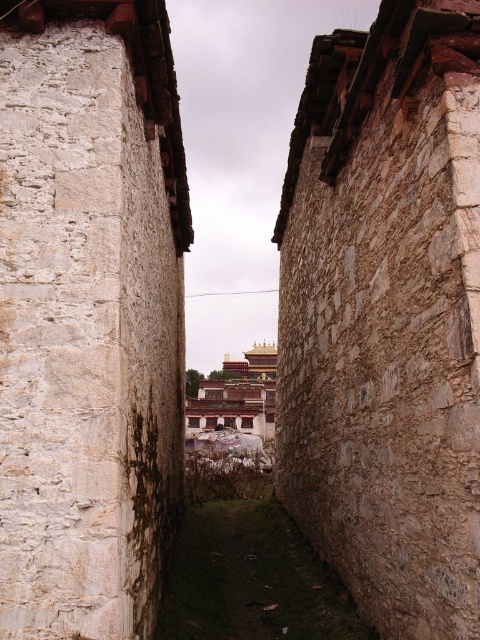
Question: Is white stone wall at center to the right of white stone monastery at center from the viewer's perspective?

Choices:
 (A) yes
 (B) no

Answer: (A)

Question: Which object is the closest to the white stone monastery at center?

Choices:
 (A) white stone wall at center
 (B) brown stone wall at right

Answer: (B)

Question: Which object appears closest to the camera in this image?

Choices:
 (A) white stone monastery at center
 (B) white stone wall at center
 (C) brown stone wall at right

Answer: (B)

Question: Is brown stone wall at right to the left of white stone monastery at center from the viewer's perspective?

Choices:
 (A) yes
 (B) no

Answer: (B)

Question: Among these objects, which one is farthest from the camera?

Choices:
 (A) brown stone wall at right
 (B) white stone wall at center
 (C) white stone monastery at center

Answer: (C)

Question: Is the position of brown stone wall at right more distant than that of white stone monastery at center?

Choices:
 (A) no
 (B) yes

Answer: (A)